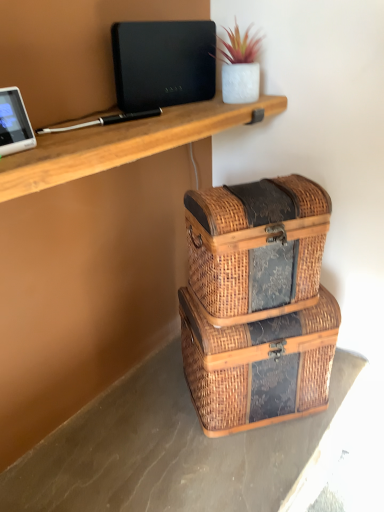
Question: Considering the relative positions of brown wicker baskets at lower right and black matte laptop at upper center in the image provided, is brown wicker baskets at lower right to the left of black matte laptop at upper center from the viewer's perspective?

Choices:
 (A) no
 (B) yes

Answer: (A)

Question: Considering the relative sizes of brown wicker baskets at lower right and black matte laptop at upper center in the image provided, is brown wicker baskets at lower right smaller than black matte laptop at upper center?

Choices:
 (A) no
 (B) yes

Answer: (A)

Question: Are brown wicker baskets at lower right and black matte laptop at upper center located far from each other?

Choices:
 (A) yes
 (B) no

Answer: (B)

Question: Is the depth of brown wicker baskets at lower right less than that of black matte laptop at upper center?

Choices:
 (A) yes
 (B) no

Answer: (A)

Question: Is brown wicker baskets at lower right facing towards black matte laptop at upper center?

Choices:
 (A) yes
 (B) no

Answer: (B)

Question: Is brown wicker baskets at lower right positioned beyond the bounds of black matte laptop at upper center?

Choices:
 (A) yes
 (B) no

Answer: (A)

Question: Is black matte laptop at upper center smaller than brown wicker baskets at lower right?

Choices:
 (A) yes
 (B) no

Answer: (A)

Question: Can you confirm if black matte laptop at upper center is shorter than brown wicker baskets at lower right?

Choices:
 (A) no
 (B) yes

Answer: (A)

Question: Can we say black matte laptop at upper center lies outside brown wicker baskets at lower right?

Choices:
 (A) yes
 (B) no

Answer: (A)

Question: Is the surface of black matte laptop at upper center in direct contact with brown wicker baskets at lower right?

Choices:
 (A) yes
 (B) no

Answer: (B)

Question: Considering the relative sizes of black matte laptop at upper center and brown wicker baskets at lower right in the image provided, is black matte laptop at upper center taller than brown wicker baskets at lower right?

Choices:
 (A) yes
 (B) no

Answer: (A)

Question: Could brown wicker baskets at lower right be considered to be inside black matte laptop at upper center?

Choices:
 (A) no
 (B) yes

Answer: (A)

Question: From a real-world perspective, is woven wood trunk at center, the first storage box in the top-to-bottom sequence, physically above woven wood storage box at lower center, the 1th storage box ordered from the bottom?

Choices:
 (A) yes
 (B) no

Answer: (A)